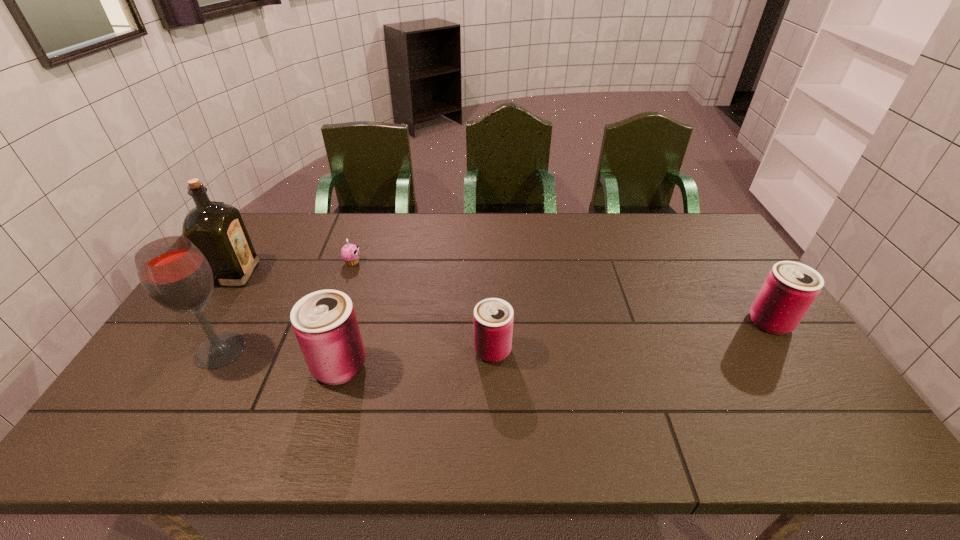
Locate an element on the screen. The image size is (960, 540). vacant space at the right edge of the desktop is located at coordinates (725, 320).

In the image, there is a desktop. Where is `free region at the far left corner`? This screenshot has height=540, width=960. free region at the far left corner is located at coordinates coord(292,224).

This screenshot has height=540, width=960. In order to click on free space between the alcohol and the leftmost can in this screenshot , I will do `click(279, 358)`.

Locate an element on the screen. free space between the rightmost can and the shortest object is located at coordinates 561,292.

Identify the location of free point between the alcohol and the shortest object. The width and height of the screenshot is (960, 540). (286, 306).

The width and height of the screenshot is (960, 540). Identify the location of empty space that is in between the rightmost can and the cupcake. (561, 292).

The image size is (960, 540). I want to click on free point between the leftmost can and the alcohol, so click(x=279, y=358).

Where is `free space between the alcohol and the leftmost can`? Image resolution: width=960 pixels, height=540 pixels. free space between the alcohol and the leftmost can is located at coordinates (279, 358).

Where is `free space between the shortest object and the alcohol`? free space between the shortest object and the alcohol is located at coordinates [286, 306].

I want to click on empty location between the liquor and the rightmost can, so pos(503,298).